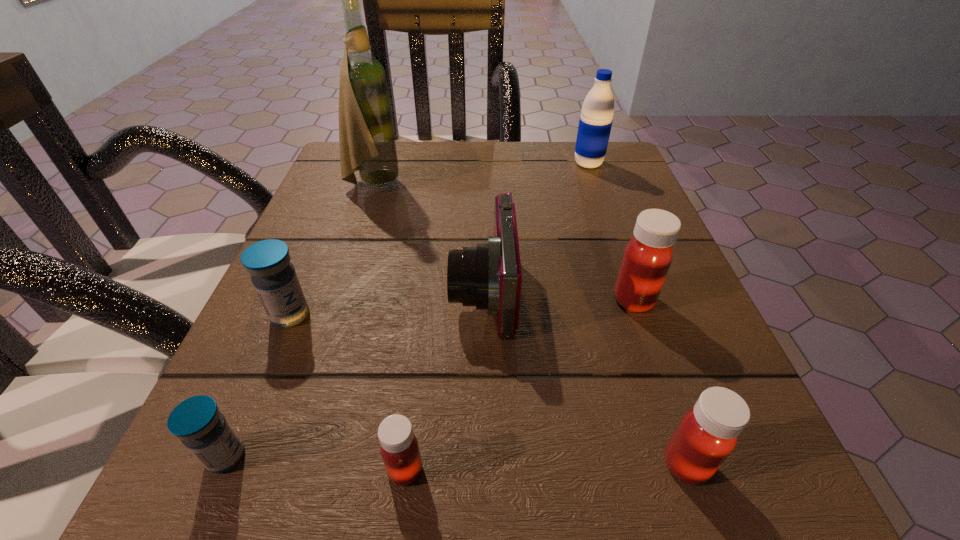
This screenshot has height=540, width=960. What are the coordinates of `red medicine that can be found as the third closest to the blue water bottle` in the screenshot? It's located at (399, 448).

Locate which red medicine ranks in proximity to the third tallest object. Please provide its 2D coordinates. Your answer should be formatted as a tuple, i.e. [(x, y)], where the tuple contains the x and y coordinates of a point satisfying the conditions above.

[(707, 434)]

You are a GUI agent. You are given a task and a screenshot of the screen. Output one action in this format:
    pyautogui.click(x=<x>, y=<y>)
    Task: Click on the blank space that satisfies the following two spatial constraints: 1. on the front-facing side of the second smallest red medicine; 2. on the right side of the fourth object from right to left
    This screenshot has width=960, height=540.
    Given the screenshot: What is the action you would take?
    pyautogui.click(x=484, y=464)

Where is `free region that satisfies the following two spatial constraints: 1. on the back side of the tallest medicine; 2. on the left side of the second smallest red medicine`? The width and height of the screenshot is (960, 540). free region that satisfies the following two spatial constraints: 1. on the back side of the tallest medicine; 2. on the left side of the second smallest red medicine is located at coordinates (630, 300).

Where is `vacant space that satisfies the following two spatial constraints: 1. on the front-facing side of the wine bottle; 2. on the right side of the smallest red medicine`? The height and width of the screenshot is (540, 960). vacant space that satisfies the following two spatial constraints: 1. on the front-facing side of the wine bottle; 2. on the right side of the smallest red medicine is located at coordinates (279, 470).

Identify the location of free point that satisfies the following two spatial constraints: 1. on the front-facing side of the tallest object; 2. on the right side of the leftmost red medicine. (279, 470).